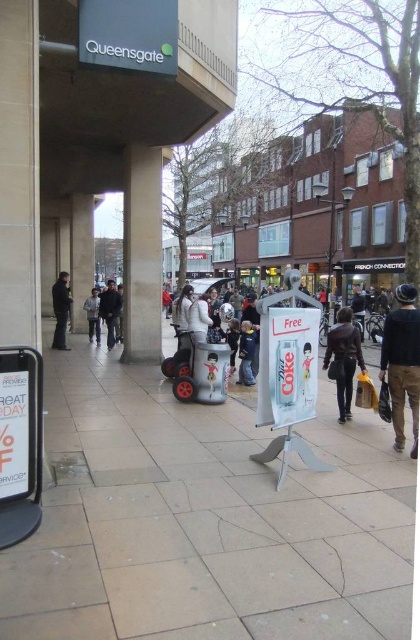
Question: Which point appears farthest from the camera in this image?

Choices:
 (A) (202, 336)
 (B) (57, 314)
 (C) (183, 323)
 (D) (394, 378)

Answer: (B)

Question: Observing the image, what is the correct spatial positioning of matte white scooter at center in reference to white cotton jacket at center?

Choices:
 (A) left
 (B) right

Answer: (B)

Question: From the image, what is the correct spatial relationship of white cotton jacket at center in relation to light brown leather jacket at center?

Choices:
 (A) below
 (B) above

Answer: (B)

Question: Considering the real-world distances, which object is farthest from the dark gray jacket at left?

Choices:
 (A) denim jacket at center
 (B) white cotton jacket at center

Answer: (B)

Question: Is smooth concrete pavement at center thinner than matte white scooter at center?

Choices:
 (A) yes
 (B) no

Answer: (A)

Question: Which object is closer to the camera taking this photo?

Choices:
 (A) white cotton jacket at center
 (B) dark brown leather jacket at lower right
 (C) light brown leather jacket at center
 (D) smooth concrete pavement at center

Answer: (D)